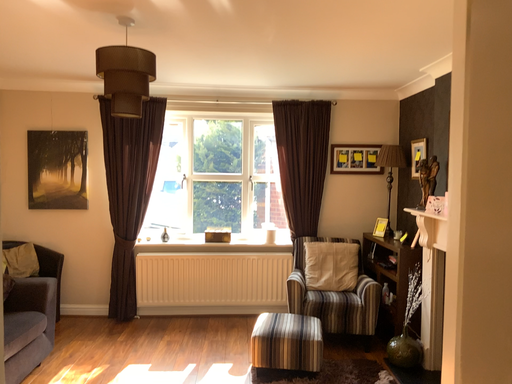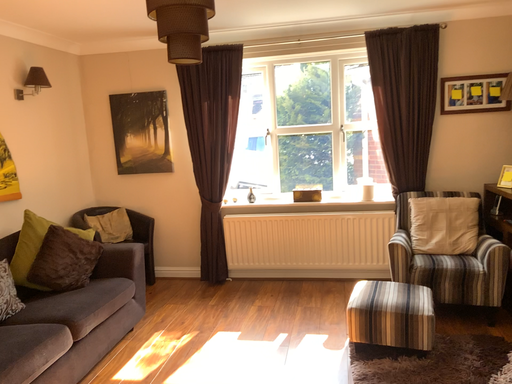
Question: Which way did the camera rotate in the video?

Choices:
 (A) rotated right
 (B) rotated left

Answer: (B)